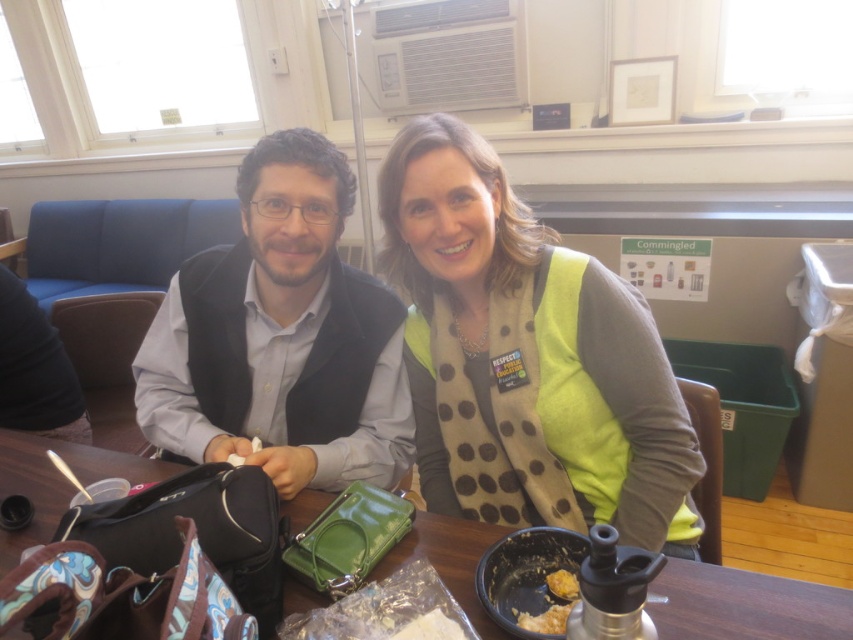
You are a delivery person standing in front of the table with the green polka dot scarf at center. Your delivery robot has a 1.0 meter arm reach. Can it pick up the scarf?

The distance between the green polka dot scarf at center and the viewer is 1.01 meters. Since the robot arm can only reach 1.0 meters, it cannot reach the scarf.

You are a security guard checking the items on the table and the vest. Which item is closer to you, the matte black vest at center or the wooden table at center?

The wooden table at center is behind the matte black vest at center, so the matte black vest at center is closer to you.